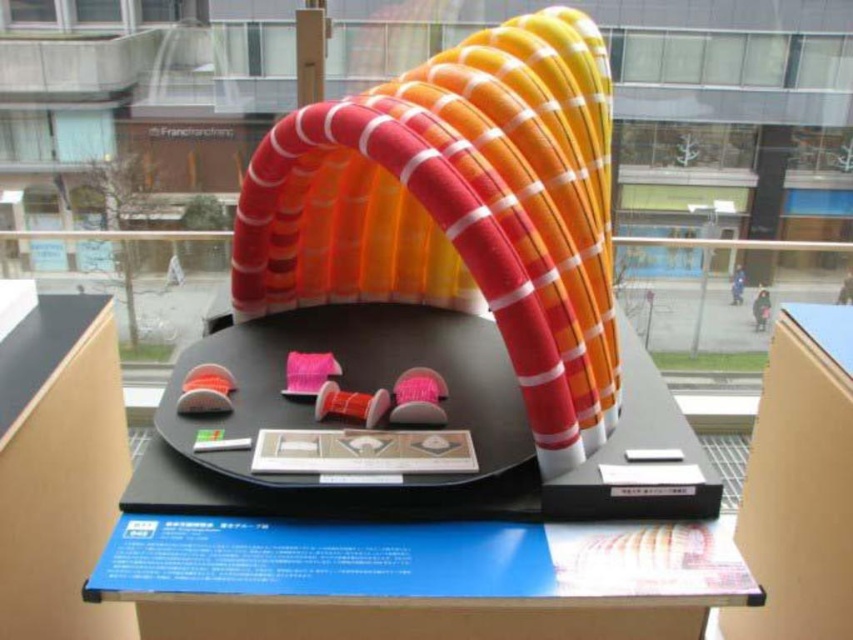
Can you confirm if pink matte spool at center is wider than pink fabric spool at center?

Yes, pink matte spool at center is wider than pink fabric spool at center.

This screenshot has width=853, height=640. What do you see at coordinates (350, 403) in the screenshot?
I see `pink matte spool at center` at bounding box center [350, 403].

Does point (344, 403) lie in front of point (296, 356)?

Yes, it is.

At what (x,y) coordinates should I click in order to perform the action: click on pink matte spool at center. Please return your answer as a coordinate pair (x, y). This screenshot has width=853, height=640. Looking at the image, I should click on (350, 403).

Which of these two, pink fuzzy ball at center or pink fabric spool at center, stands taller?

With more height is pink fuzzy ball at center.

The width and height of the screenshot is (853, 640). Describe the element at coordinates (418, 397) in the screenshot. I see `pink fuzzy ball at center` at that location.

The height and width of the screenshot is (640, 853). In order to click on pink fuzzy ball at center in this screenshot , I will do `click(418, 397)`.

Who is more distant from viewer, (618, 598) or (308, 387)?

Point (308, 387)

Which is below, black matte table at center or pink fabric spool at center?

black matte table at center

Where is `black matte table at center`? black matte table at center is located at coordinates pyautogui.click(x=412, y=563).

Where is `black matte table at center`? black matte table at center is located at coordinates (412, 563).